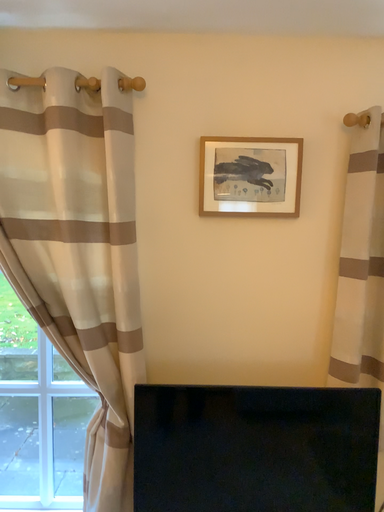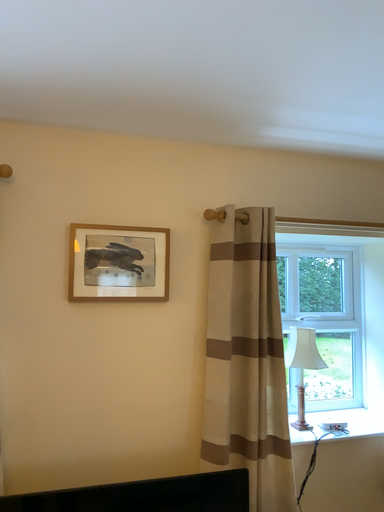
Question: How did the camera likely rotate when shooting the video?

Choices:
 (A) rotated right
 (B) rotated left

Answer: (A)